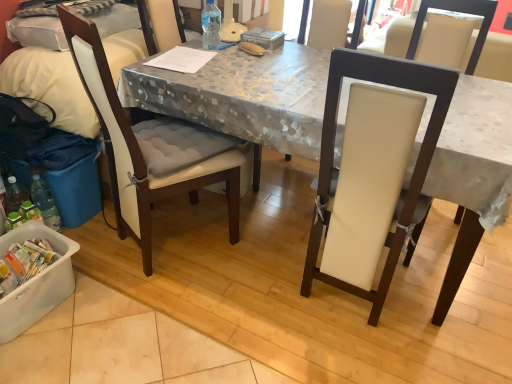
Identify the location of empty space that is in between white padded chair at left, the 2th chair positioned from the right, and white fabric-covered desk at center. (246, 300).